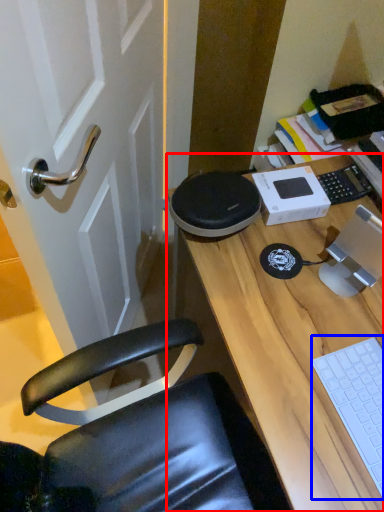
Question: Which of the following is the closest to the observer, desk (highlighted by a red box) or laptop keyboard (highlighted by a blue box)?

Choices:
 (A) desk
 (B) laptop keyboard

Answer: (A)